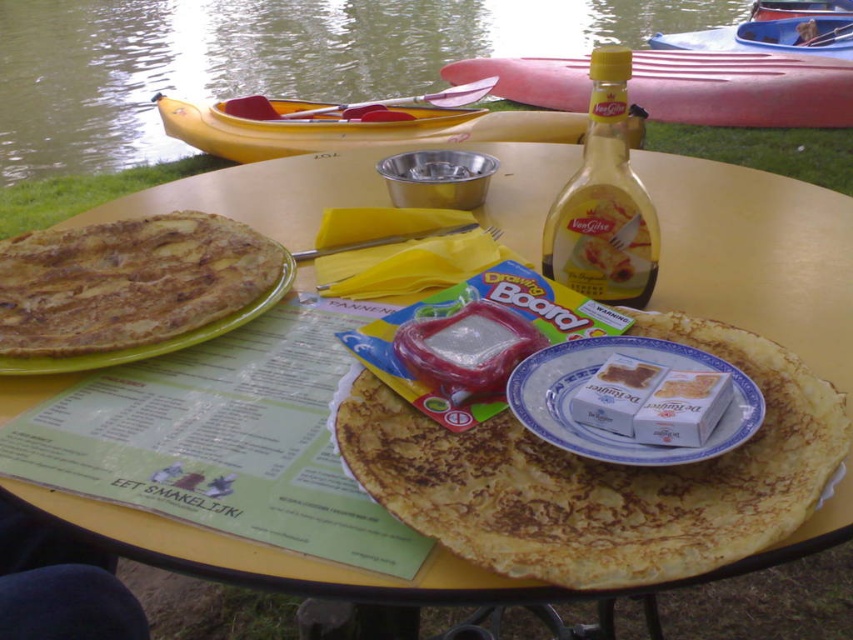
You are sitting at the round yellow table by the water and want to reach for the syrup bottle placed at point (213,278). Is this point closer to you than the napkin holder at point (463,74)?

Yes, the syrup bottle at point (213,278) is closer to you than the napkin holder at point (463,74) because it is in front of it.

You are planning to place a 10cm wide plate on the table. The golden crispy pancake at center and the rubber kayak at upper center are already on the table. Which object has enough space to accommodate the new plate next to it?

The rubber kayak at upper center has a greater width than the golden crispy pancake at center, so placing the 10cm wide plate next to the rubber kayak at upper center would have more space available.